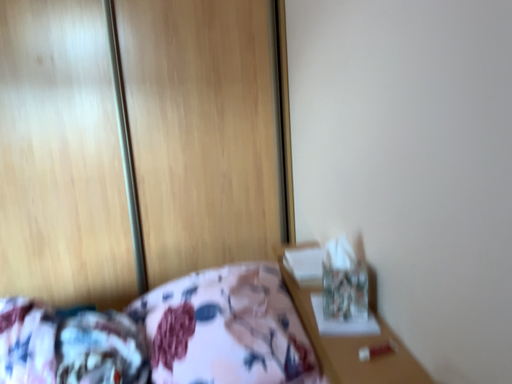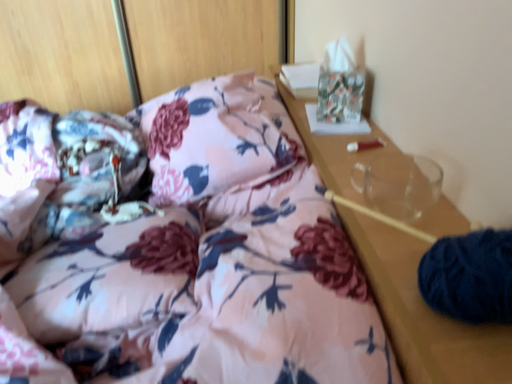
Question: Which way did the camera rotate in the video?

Choices:
 (A) rotated downward
 (B) rotated upward

Answer: (A)